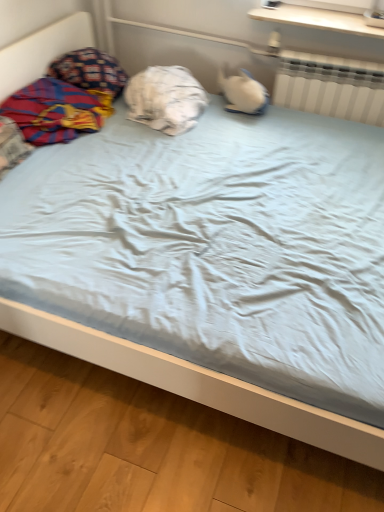
Question: Do you think plaid fabric blanket at left is within white plastic radiator at upper right, or outside of it?

Choices:
 (A) inside
 (B) outside

Answer: (B)

Question: From the image's perspective, is plaid fabric blanket at left positioned above or below white plastic radiator at upper right?

Choices:
 (A) above
 (B) below

Answer: (B)

Question: Estimate the real-world distances between objects in this image. Which object is farther from the patterned fabric pillow at upper left, positioned as the second pillow in right-to-left order?

Choices:
 (A) white plastic radiator at upper right
 (B) plaid fabric blanket at left
 (C) white wood shelf at upper center
 (D) white cotton pillow at center, the 2th pillow from the left

Answer: (A)

Question: Which object is the closest to the white plastic radiator at upper right?

Choices:
 (A) white cotton pillow at center, the 2th pillow from the left
 (B) patterned fabric pillow at upper left, positioned as the second pillow in right-to-left order
 (C) white wood shelf at upper center
 (D) plaid fabric blanket at left

Answer: (C)